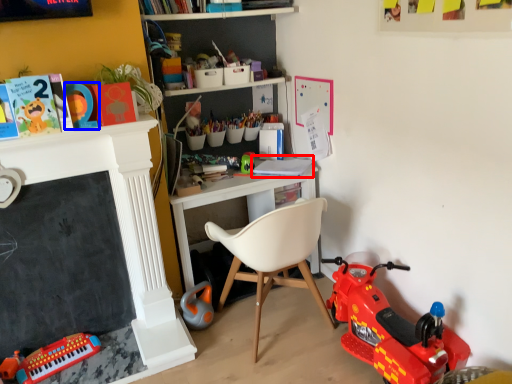
Question: Which object appears farthest to the camera in this image, book (highlighted by a red box) or toy (highlighted by a blue box)?

Choices:
 (A) book
 (B) toy

Answer: (A)